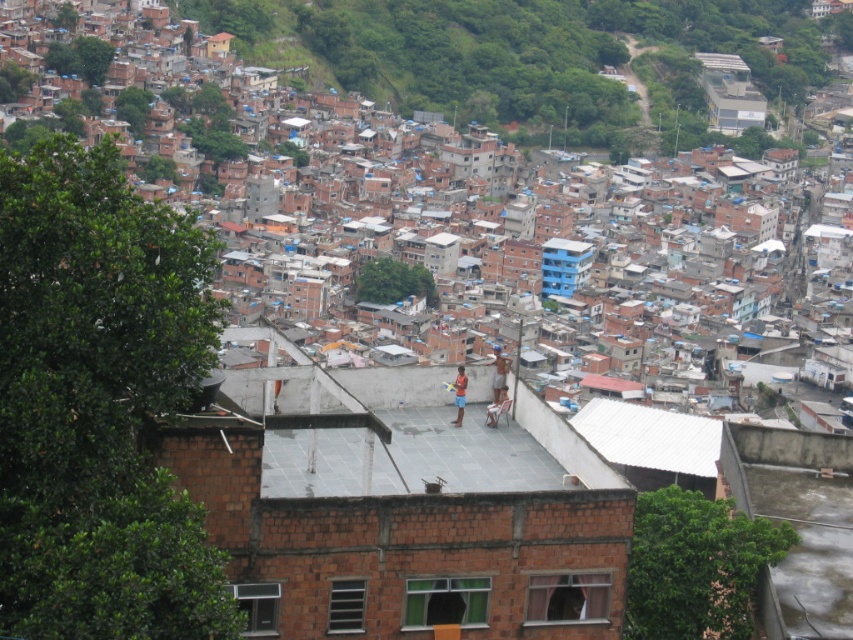
You are a delivery drone flying over the urban area. You need to deliver a package to the white corrugated metal roof at center. However, there are brown brick houses at upper left in the way. Can you fly over them to reach your destination?

The white corrugated metal roof at center is behind the brown brick houses at upper left, so the drone can fly over the brown brick houses at upper left to reach the white corrugated metal roof at center.

You are standing on the rooftop in the foreground of the urban area. There is a point marked at coordinates (534, 54). Which object in the scene does this point correspond to?

The point at coordinates (534, 54) corresponds to the brown brick houses at upper left.

You are standing on the rooftop where the two people are. You want to throw a small ball to someone standing at the brown brick houses at upper left. Can you reach them with a single throw?

The brown brick houses at upper left are 1028.35 feet away from the viewer. Since this distance is extremely long for a single throw, you cannot reach them with a single throw.